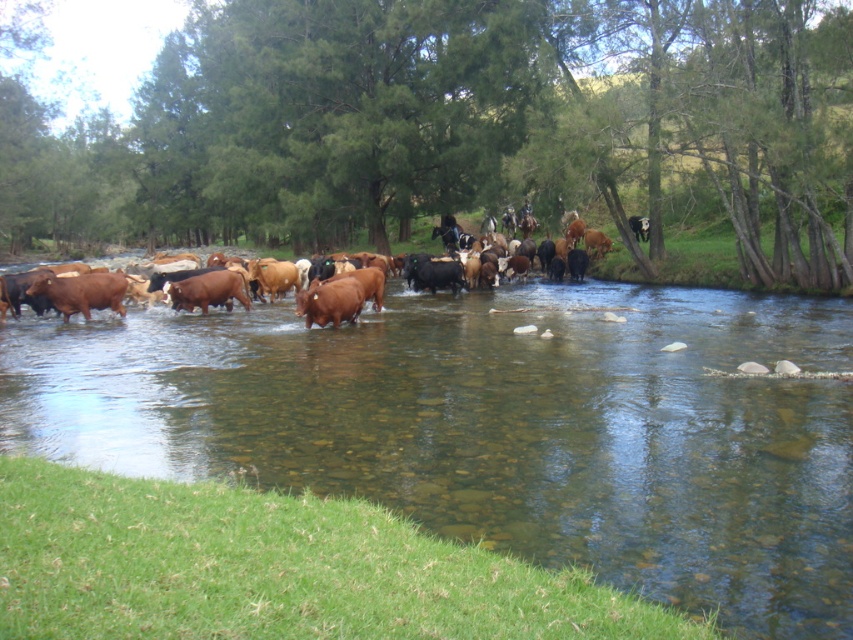
Who is lower down, clear water stream at center or brown matte cow at center?

Positioned lower is clear water stream at center.

Can you confirm if clear water stream at center is wider than brown matte cow at center?

Yes, clear water stream at center is wider than brown matte cow at center.

The width and height of the screenshot is (853, 640). What do you see at coordinates (498, 428) in the screenshot?
I see `clear water stream at center` at bounding box center [498, 428].

I want to click on clear water stream at center, so click(498, 428).

Between clear water stream at center and brown glossy cows at center, which one appears on the left side from the viewer's perspective?

Positioned to the left is brown glossy cows at center.

Locate an element on the screen. The width and height of the screenshot is (853, 640). clear water stream at center is located at coordinates (498, 428).

From the picture: Who is more distant from viewer, [280,436] or [28,298]?

The point [28,298] is more distant.

You are a GUI agent. You are given a task and a screenshot of the screen. Output one action in this format:
    pyautogui.click(x=<x>, y=<y>)
    Task: Click on the clear water stream at center
    
    Given the screenshot: What is the action you would take?
    pyautogui.click(x=498, y=428)

Based on the photo, between brown matte cow at center and brown glossy cows at center, which one appears on the left side from the viewer's perspective?

brown matte cow at center is more to the left.

What do you see at coordinates (329, 301) in the screenshot? I see `brown matte cow at center` at bounding box center [329, 301].

The image size is (853, 640). I want to click on brown matte cow at center, so click(x=329, y=301).